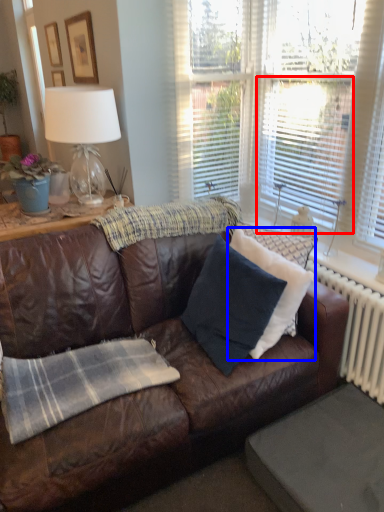
Question: Which point is further to the camera, window screen (highlighted by a red box) or pillow (highlighted by a blue box)?

Choices:
 (A) window screen
 (B) pillow

Answer: (A)